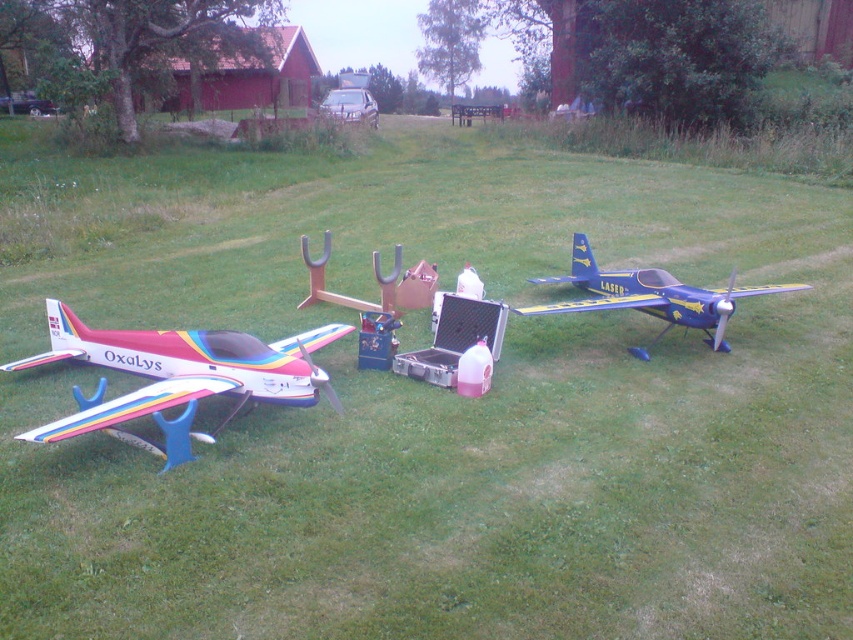
Question: Does rainbow painted model airplane at left have a larger size compared to blue metallic airplane at right?

Choices:
 (A) no
 (B) yes

Answer: (A)

Question: Where is rainbow painted model airplane at left located in relation to blue metallic airplane at right in the image?

Choices:
 (A) below
 (B) above

Answer: (A)

Question: Does rainbow painted model airplane at left lie in front of blue metallic airplane at right?

Choices:
 (A) no
 (B) yes

Answer: (B)